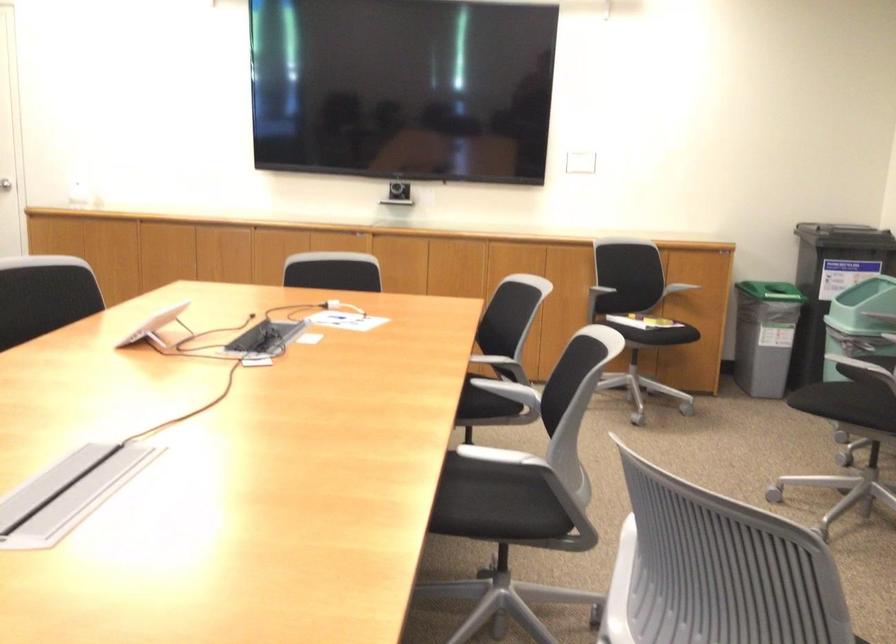
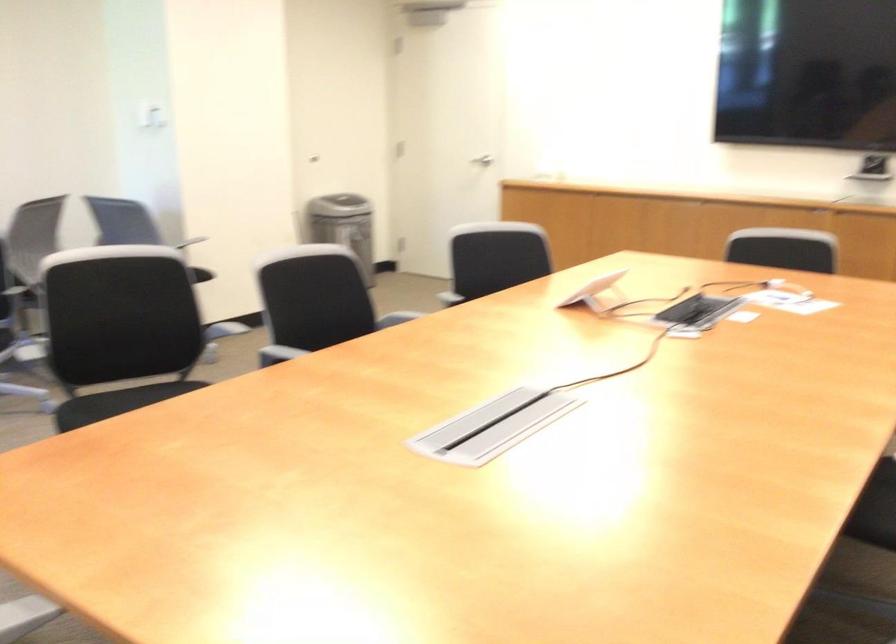
Question: Based on the continuous images, in which direction is the camera rotating? Reply with the corresponding letter.

Choices:
 (A) Left
 (B) Right
 (C) Up
 (D) Down

Answer: (A)